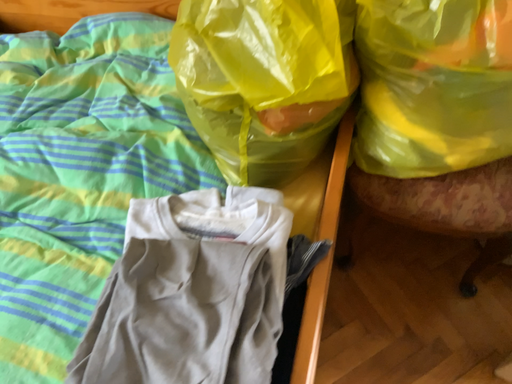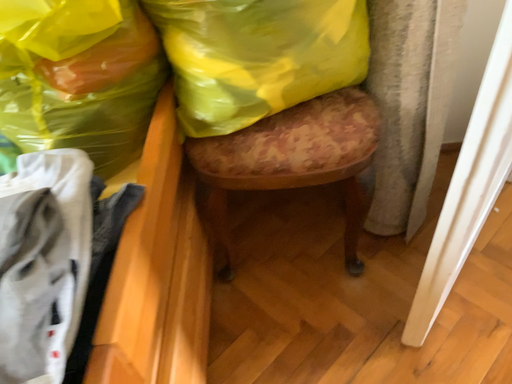
Question: Which way did the camera rotate in the video?

Choices:
 (A) rotated right
 (B) rotated left

Answer: (A)